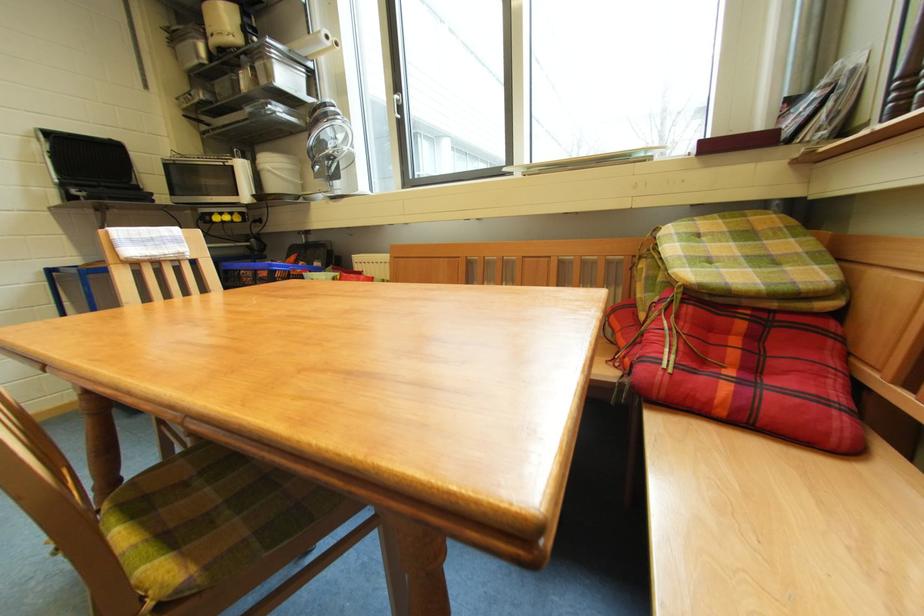
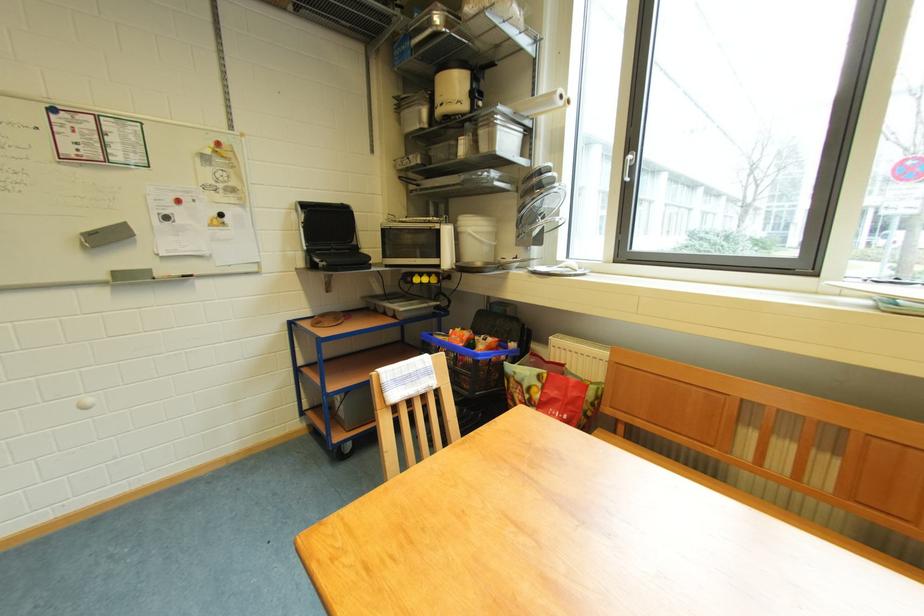
In the second image, find the point that corresponds to point (263, 61) in the first image.

(488, 127)